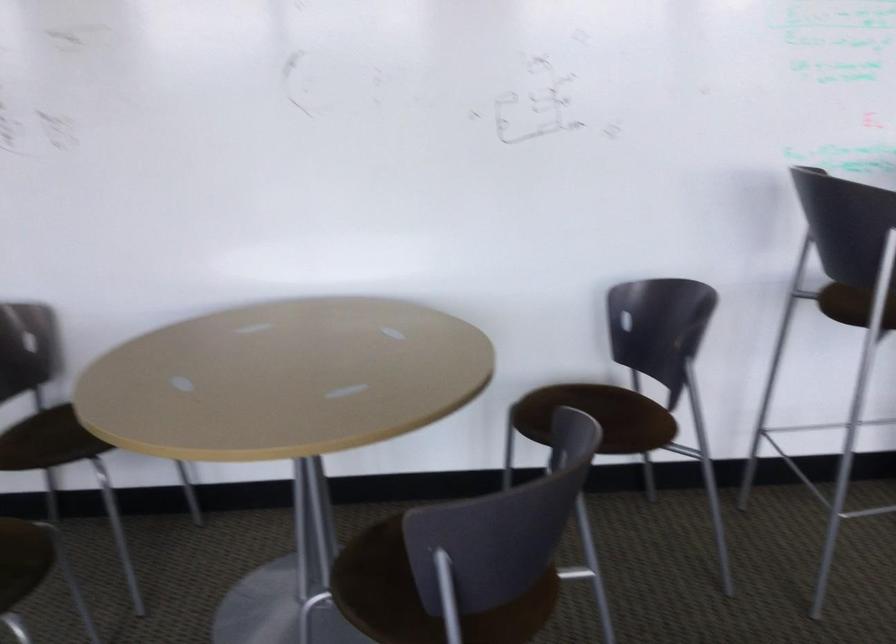
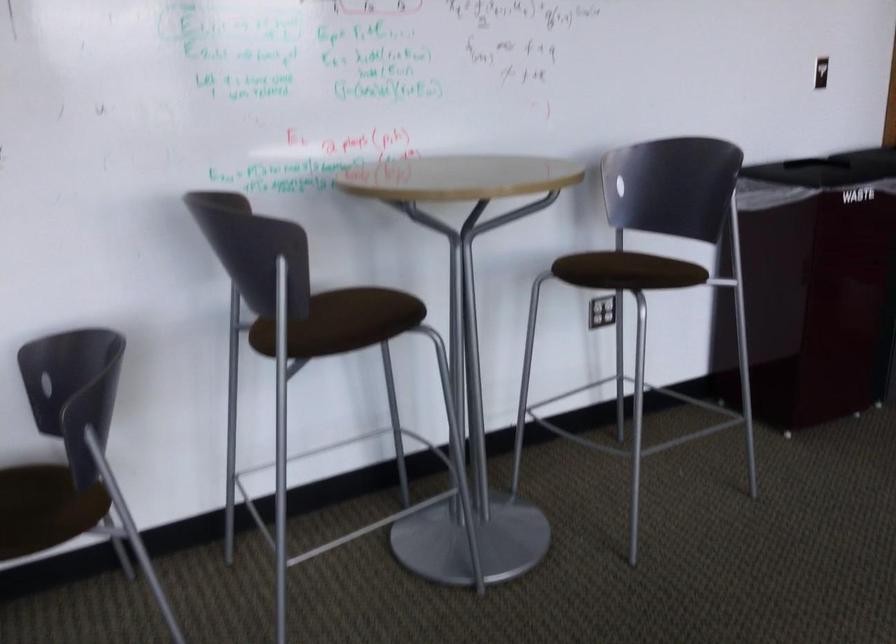
Question: The images are taken continuously from a first-person perspective. In which direction are you moving?

Choices:
 (A) Left
 (B) Right
 (C) Forward
 (D) Backward

Answer: (B)